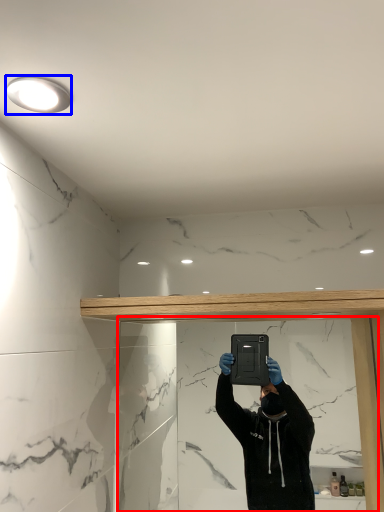
Question: Which object is closer to the camera taking this photo, mirror (highlighted by a red box) or light fixture (highlighted by a blue box)?

Choices:
 (A) mirror
 (B) light fixture

Answer: (B)